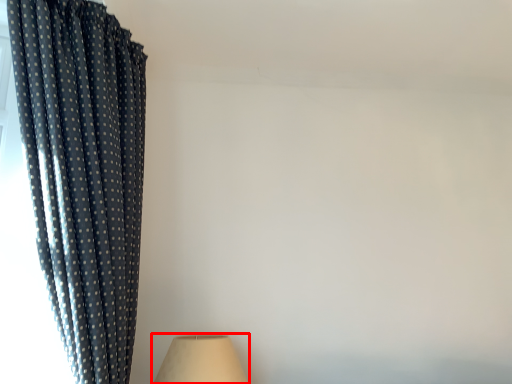
Question: From the image's perspective, what is the correct spatial positioning of lamp (annotated by the red box) in reference to curtain?

Choices:
 (A) below
 (B) above

Answer: (A)